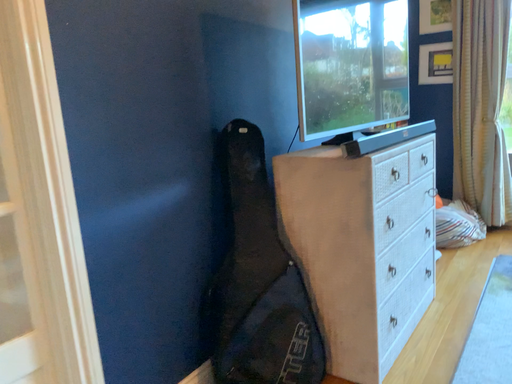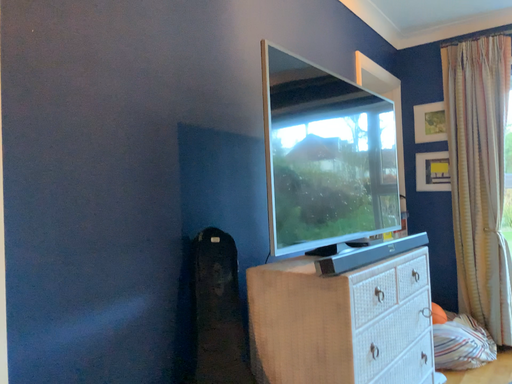
Question: How did the camera likely rotate when shooting the video?

Choices:
 (A) rotated downward
 (B) rotated upward

Answer: (B)